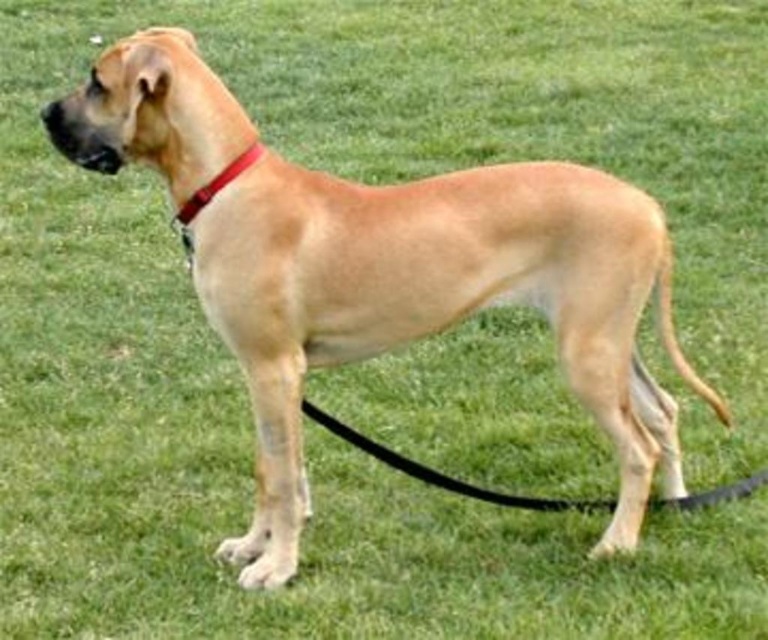
Question: Which point is farther from the camera taking this photo?

Choices:
 (A) (680, 500)
 (B) (237, 173)

Answer: (A)

Question: Does black rubber leash at lower center have a lesser width compared to red leather collar at upper left?

Choices:
 (A) yes
 (B) no

Answer: (B)

Question: Can you confirm if black rubber leash at lower center is smaller than red leather collar at upper left?

Choices:
 (A) no
 (B) yes

Answer: (A)

Question: Does black rubber leash at lower center appear under red leather collar at upper left?

Choices:
 (A) yes
 (B) no

Answer: (A)

Question: Which of the following is the farthest from the observer?

Choices:
 (A) (730, 486)
 (B) (243, 163)

Answer: (A)